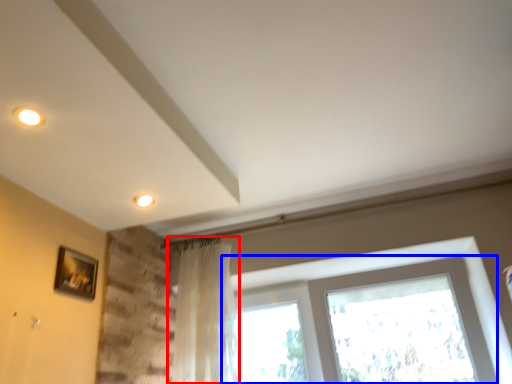
Question: Which object appears farthest to the camera in this image, curtain (highlighted by a red box) or window (highlighted by a blue box)?

Choices:
 (A) curtain
 (B) window

Answer: (A)